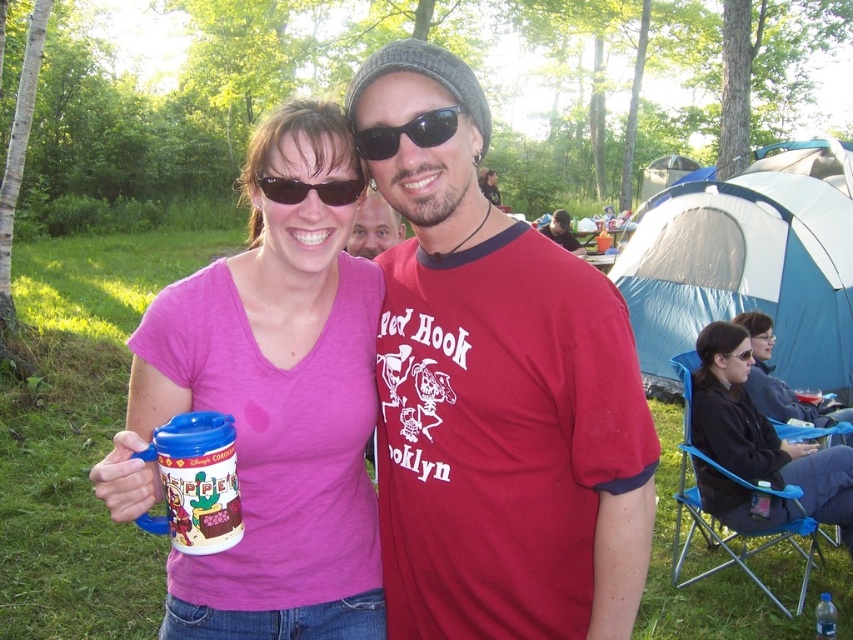
Who is positioned more to the right, blue tarpaulin tent at right or matte plastic cup at center?

blue tarpaulin tent at right is more to the right.

Is blue tarpaulin tent at right smaller than matte plastic cup at center?

No.

Is point (660, 240) in front of point (379, 243)?

No.

Where is `blue tarpaulin tent at right`? blue tarpaulin tent at right is located at coordinates (744, 273).

Is red cotton t-shirt at center taller than matte pink shirt at center?

Yes.

Between red cotton t-shirt at center and matte pink shirt at center, which one is positioned higher?

matte pink shirt at center

At what (x,y) coordinates should I click in order to perform the action: click on red cotton t-shirt at center. Please return your answer as a coordinate pair (x, y). This screenshot has height=640, width=853. Looking at the image, I should click on (496, 396).

Where is `red cotton t-shirt at center`? The width and height of the screenshot is (853, 640). red cotton t-shirt at center is located at coordinates (496, 396).

Does point (358, 129) come behind point (355, 195)?

That is False.

Does point (415, 138) come farther from viewer compared to point (286, 202)?

That is False.

This screenshot has height=640, width=853. What are the coordinates of `black reflective sunglasses at center` in the screenshot? It's located at (407, 132).